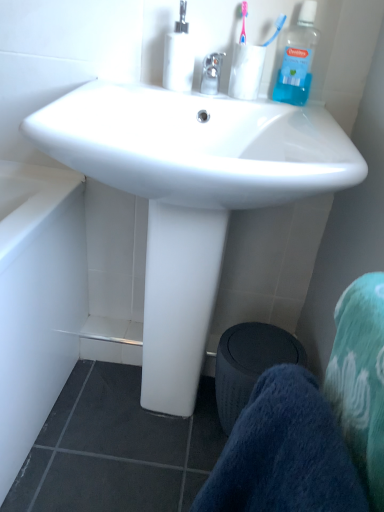
This screenshot has width=384, height=512. Describe the element at coordinates (284, 453) in the screenshot. I see `blue soft towel at lower right` at that location.

Describe the element at coordinates (246, 71) in the screenshot. I see `transparent plastic cup at upper center` at that location.

Find the location of a particular element. black fabric trash bin/can at lower center is located at coordinates (249, 364).

Measure the distance between transparent plastic soap dispenser at upper center, placed as the first bottle when sorted from left to right, and camera.

36.87 inches.

Locate an element on the screen. white glossy sink at center is located at coordinates (191, 194).

You are a GUI agent. You are given a task and a screenshot of the screen. Output one action in this format:
    pyautogui.click(x=<x>, y=<y>)
    Task: Click on the blue translucent bottle at upper right, arranged as the 1th bottle when viewed from the right
    
    Given the screenshot: What is the action you would take?
    pyautogui.click(x=296, y=58)

Where is `toiletries on the right side of white glossy sink at center`? Image resolution: width=384 pixels, height=512 pixels. toiletries on the right side of white glossy sink at center is located at coordinates (276, 29).

Is blue plastic toothbrush at upper right closer to camera compared to white glossy sink at center?

No, it is not.

How much distance is there between blue plastic toothbrush at upper right and white glossy sink at center?

blue plastic toothbrush at upper right is 18.70 inches from white glossy sink at center.

What's the angular difference between blue soft towel at lower right and blue translucent bottle at upper right, which is counted as the second bottle, starting from the left,'s facing directions?

The angle between the facing direction of blue soft towel at lower right and the facing direction of blue translucent bottle at upper right, which is counted as the second bottle, starting from the left, is 76.1 degrees.

Is blue soft towel at lower right positioned far away from blue translucent bottle at upper right, which is counted as the second bottle, starting from the left?

No, blue soft towel at lower right is not far from blue translucent bottle at upper right, which is counted as the second bottle, starting from the left.

Considering the relative positions of blue soft towel at lower right and blue translucent bottle at upper right, arranged as the 1th bottle when viewed from the right, in the image provided, is blue soft towel at lower right in front of blue translucent bottle at upper right, arranged as the 1th bottle when viewed from the right,?

Yes, blue soft towel at lower right is closer to the viewer.

From a real-world perspective, is blue soft towel at lower right under blue translucent bottle at upper right, arranged as the 1th bottle when viewed from the right?

Yes, from a real-world perspective, blue soft towel at lower right is below blue translucent bottle at upper right, arranged as the 1th bottle when viewed from the right.

Which is in front, clear glass faucet at center or white glossy sink at center?

white glossy sink at center.

Considering the sizes of clear glass faucet at center and white glossy sink at center in the image, is clear glass faucet at center bigger or smaller than white glossy sink at center?

Considering their sizes, clear glass faucet at center takes up less space than white glossy sink at center.

Can you tell me how much clear glass faucet at center and white glossy sink at center differ in facing direction?

1.65 degrees separate the facing orientations of clear glass faucet at center and white glossy sink at center.

Would you say clear glass faucet at center contains white glossy sink at center?

No, white glossy sink at center is not inside clear glass faucet at center.

Is blue translucent bottle at upper right, which is counted as the second bottle, starting from the left, positioned beyond the bounds of blue plastic toothbrush at upper right?

Yes, blue translucent bottle at upper right, which is counted as the second bottle, starting from the left, is located beyond the bounds of blue plastic toothbrush at upper right.

From a real-world perspective, is blue translucent bottle at upper right, arranged as the 1th bottle when viewed from the right, positioned under blue plastic toothbrush at upper right based on gravity?

Yes.

Measure the distance between blue translucent bottle at upper right, arranged as the 1th bottle when viewed from the right, and blue plastic toothbrush at upper right.

blue translucent bottle at upper right, arranged as the 1th bottle when viewed from the right, and blue plastic toothbrush at upper right are 7.38 centimeters apart from each other.

Is blue translucent bottle at upper right, which is counted as the second bottle, starting from the left, far from blue plastic toothbrush at upper right?

That's not correct — blue translucent bottle at upper right, which is counted as the second bottle, starting from the left, is a little close to blue plastic toothbrush at upper right.

From the image's perspective, which one is positioned higher, transparent plastic cup at upper center or blue translucent bottle at upper right, which is counted as the second bottle, starting from the left?

blue translucent bottle at upper right, which is counted as the second bottle, starting from the left, appears higher in the image.

Is transparent plastic cup at upper center oriented away from blue translucent bottle at upper right, arranged as the 1th bottle when viewed from the right?

No, transparent plastic cup at upper center's orientation is not away from blue translucent bottle at upper right, arranged as the 1th bottle when viewed from the right.

Is transparent plastic cup at upper center placed right next to blue translucent bottle at upper right, arranged as the 1th bottle when viewed from the right?

Yes, transparent plastic cup at upper center is right next to blue translucent bottle at upper right, arranged as the 1th bottle when viewed from the right, and making contact.

Considering the positions of points (259, 56) and (273, 90), is point (259, 56) farther from camera compared to point (273, 90)?

No, (259, 56) is closer to viewer.

Relative to blue translucent bottle at upper right, arranged as the 1th bottle when viewed from the right, is white glossy sink at center in front or behind?

Clearly, white glossy sink at center is in front of blue translucent bottle at upper right, arranged as the 1th bottle when viewed from the right.

Is white glossy sink at center to the right of blue translucent bottle at upper right, arranged as the 1th bottle when viewed from the right, from the viewer's perspective?

Incorrect, white glossy sink at center is not on the right side of blue translucent bottle at upper right, arranged as the 1th bottle when viewed from the right.

Between white glossy sink at center and blue translucent bottle at upper right, arranged as the 1th bottle when viewed from the right, which one has larger size?

Bigger between the two is white glossy sink at center.

Is blue soft towel at lower right turned away from clear glass faucet at center?

No, blue soft towel at lower right's orientation is not away from clear glass faucet at center.

How many degrees apart are the facing directions of blue soft towel at lower right and clear glass faucet at center?

They differ by 85.8 degrees in their facing directions.

From a real-world perspective, is blue soft towel at lower right on top of clear glass faucet at center?

Actually, blue soft towel at lower right is physically below clear glass faucet at center in the real world.

From the image's perspective, is blue soft towel at lower right below clear glass faucet at center?

Indeed, from the image's perspective, blue soft towel at lower right is shown beneath clear glass faucet at center.

Find the location of `toiletries lying behind the white glossy sink at center`. toiletries lying behind the white glossy sink at center is located at coordinates (276, 29).

This screenshot has height=512, width=384. I want to click on towel/napkin on the left of blue translucent bottle at upper right, which is counted as the second bottle, starting from the left, so click(284, 453).

Consider the image. From the image, which object appears to be farther from blue soft towel at lower right, blue translucent bottle at upper right, which is counted as the second bottle, starting from the left, or clear glass faucet at center?

blue translucent bottle at upper right, which is counted as the second bottle, starting from the left, lies further to blue soft towel at lower right than the other object.

Based on their spatial positions, is white glossy sink at center or transparent plastic soap dispenser at upper center, placed as the first bottle when sorted from left to right, closer to blue soft towel at lower right?

white glossy sink at center lies closer to blue soft towel at lower right than the other object.

Based on their spatial positions, is black fabric trash bin/can at lower center or transparent plastic soap dispenser at upper center, placed as the first bottle when sorted from left to right, closer to blue plastic toothbrush at upper right?

transparent plastic soap dispenser at upper center, placed as the first bottle when sorted from left to right, is positioned closer to the anchor blue plastic toothbrush at upper right.

Based on their spatial positions, is clear glass faucet at center or transparent plastic cup at upper center further from blue soft towel at lower right?

clear glass faucet at center lies further to blue soft towel at lower right than the other object.

Looking at the image, which one is located closer to blue soft towel at lower right, blue plastic toothbrush at upper right or transparent plastic soap dispenser at upper center, the second bottle from the right?

transparent plastic soap dispenser at upper center, the second bottle from the right, is closer to blue soft towel at lower right.

Looking at the image, which one is located further to blue translucent bottle at upper right, arranged as the 1th bottle when viewed from the right, transparent plastic soap dispenser at upper center, placed as the first bottle when sorted from left to right, or transparent plastic cup at upper center?

Among the two, transparent plastic soap dispenser at upper center, placed as the first bottle when sorted from left to right, is located further to blue translucent bottle at upper right, arranged as the 1th bottle when viewed from the right.

Based on their spatial positions, is transparent plastic soap dispenser at upper center, placed as the first bottle when sorted from left to right, or black fabric trash bin/can at lower center closer to white glossy sink at center?

black fabric trash bin/can at lower center is closer to white glossy sink at center.

Which object lies nearer to the anchor point clear glass faucet at center, blue plastic toothbrush at upper right or transparent plastic cup at upper center?

transparent plastic cup at upper center is positioned closer to the anchor clear glass faucet at center.

The image size is (384, 512). In order to click on coffee cup located between clear glass faucet at center and blue translucent bottle at upper right, arranged as the 1th bottle when viewed from the right, in the left-right direction in this screenshot , I will do `click(246, 71)`.

You are a GUI agent. You are given a task and a screenshot of the screen. Output one action in this format:
    pyautogui.click(x=<x>, y=<y>)
    Task: Click on the coffee cup between blue plastic toothbrush at upper right and white glossy sink at center in the vertical direction
    The width and height of the screenshot is (384, 512).
    Given the screenshot: What is the action you would take?
    pyautogui.click(x=246, y=71)

You are a GUI agent. You are given a task and a screenshot of the screen. Output one action in this format:
    pyautogui.click(x=<x>, y=<y>)
    Task: Click on the faucet between transparent plastic soap dispenser at upper center, the second bottle from the right, and blue soft towel at lower right vertically
    Image resolution: width=384 pixels, height=512 pixels.
    Given the screenshot: What is the action you would take?
    pyautogui.click(x=211, y=73)

This screenshot has width=384, height=512. What are the coordinates of `towel/napkin between blue plastic toothbrush at upper right and black fabric trash bin/can at lower center in the vertical direction` in the screenshot? It's located at (284, 453).